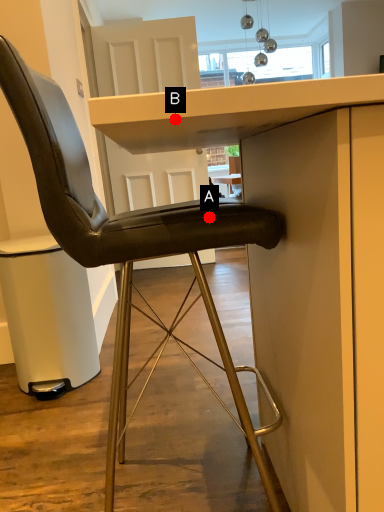
Question: Two points are circled on the image, labeled by A and B beside each circle. Which point is farther from the camera taking this photo?

Choices:
 (A) A is further
 (B) B is further

Answer: (A)